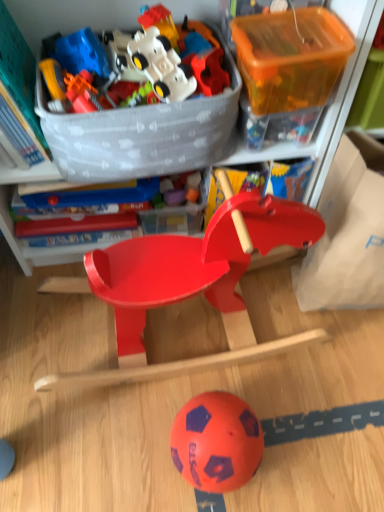
Locate an element on the screen. vacant area located to the right-hand side of orange rubber ball at lower center is located at coordinates (294, 444).